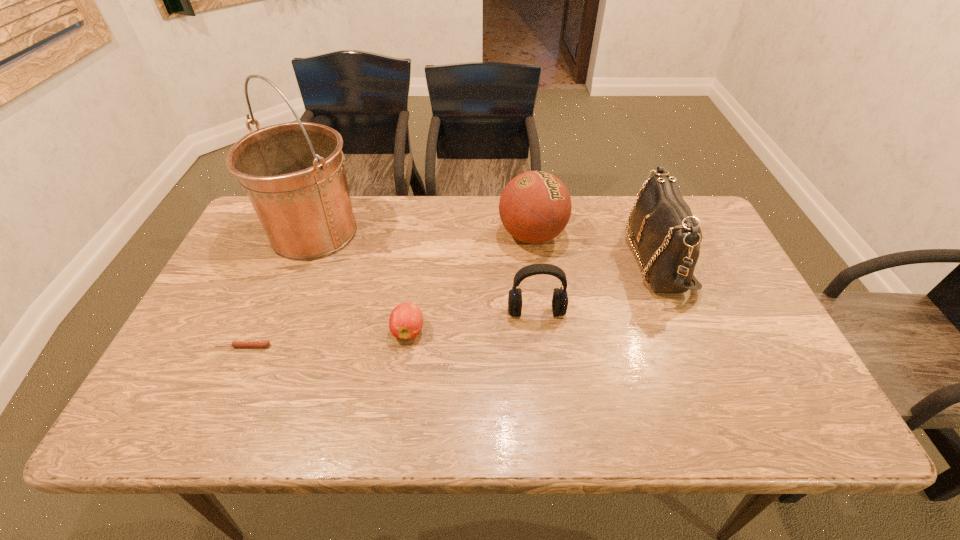
This screenshot has width=960, height=540. In order to click on vacant space located 0.150m at the front of the handbag with chain and zipper in this screenshot , I will do `click(577, 258)`.

Find the location of a particular element. This screenshot has width=960, height=540. free space located on the right of the basketball is located at coordinates pos(674,235).

Where is `free location located on the headband of the headset`? The height and width of the screenshot is (540, 960). free location located on the headband of the headset is located at coordinates (540, 348).

At what (x,y) coordinates should I click in order to perform the action: click on free location located 0.310m on the left of the fourth object from right to left. Please return your answer as a coordinate pair (x, y). This screenshot has width=960, height=540. Looking at the image, I should click on (267, 330).

The width and height of the screenshot is (960, 540). Identify the location of blank space located 0.080m on the back of the sausage. (255, 318).

Locate an element on the screen. bucket that is at the far edge is located at coordinates (294, 174).

You are a GUI agent. You are given a task and a screenshot of the screen. Output one action in this format:
    pyautogui.click(x=<x>, y=<y>)
    Task: Click on the handbag located in the far edge section of the desktop
    Image resolution: width=960 pixels, height=540 pixels.
    Given the screenshot: What is the action you would take?
    pyautogui.click(x=667, y=235)

Find the location of a particular element. The width and height of the screenshot is (960, 540). basketball present at the far edge is located at coordinates (535, 207).

You are a GUI agent. You are given a task and a screenshot of the screen. Output one action in this format:
    pyautogui.click(x=<x>, y=<y>)
    Task: Click on the bucket situated at the left edge
    
    Given the screenshot: What is the action you would take?
    pyautogui.click(x=294, y=174)

Where is `sausage at the left edge`? Image resolution: width=960 pixels, height=540 pixels. sausage at the left edge is located at coordinates (237, 343).